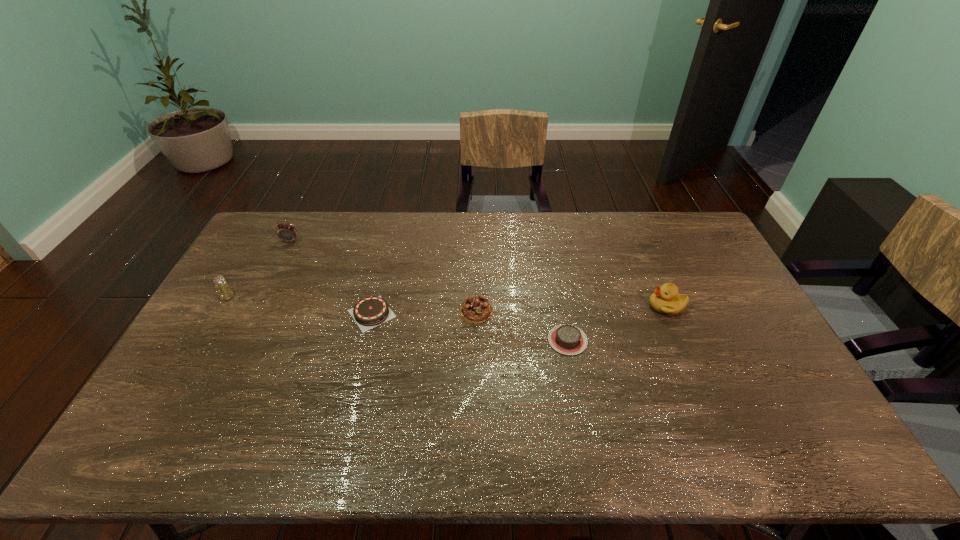
Locate an element on the screen. saltshaker located in the left edge section of the desktop is located at coordinates (225, 292).

Where is `object situated at the far left corner`? The height and width of the screenshot is (540, 960). object situated at the far left corner is located at coordinates (286, 232).

Find the location of `vacant space at the far edge of the desktop`. vacant space at the far edge of the desktop is located at coordinates (324, 224).

The width and height of the screenshot is (960, 540). Identify the location of vacant space at the near edge of the desktop. tap(472, 455).

Locate an element on the screen. vacant space at the left edge is located at coordinates (234, 308).

Find the location of a particular element. free space at the far left corner of the desktop is located at coordinates (285, 222).

In the image, there is a desktop. Identify the location of vacant space at the far right corner. (674, 221).

In the image, there is a desktop. Identify the location of vacant space at the near right corner. (810, 447).

Find the location of a particular element. empty location between the second chocolate cake from right to left and the second shortest chocolate cake is located at coordinates (423, 312).

Locate an element on the screen. free area in between the tallest chocolate cake and the fifth object from right to left is located at coordinates (383, 276).